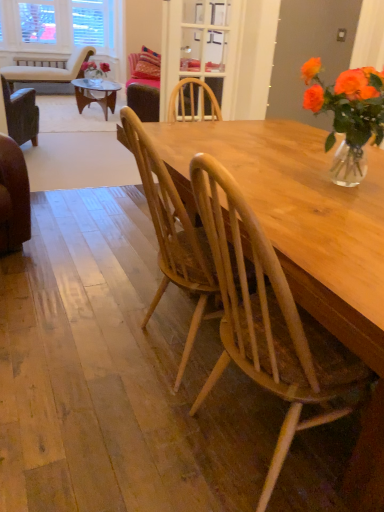
Question: Is clear glass door at upper center taller than beige fabric chair at upper left, the third chair ordered from the bottom?

Choices:
 (A) yes
 (B) no

Answer: (A)

Question: Would you say beige fabric chair at upper left, the first chair from the left, is part of clear glass door at upper center's contents?

Choices:
 (A) yes
 (B) no

Answer: (B)

Question: Does clear glass door at upper center have a lesser width compared to beige fabric chair at upper left, the 1th chair viewed from the back?

Choices:
 (A) yes
 (B) no

Answer: (A)

Question: Does clear glass door at upper center appear on the left side of beige fabric chair at upper left, the third chair ordered from the bottom?

Choices:
 (A) yes
 (B) no

Answer: (B)

Question: Does clear glass door at upper center turn towards beige fabric chair at upper left, which ranks as the third chair in right-to-left order?

Choices:
 (A) yes
 (B) no

Answer: (B)

Question: From the image's perspective, is clear glass door at upper center over beige fabric chair at upper left, which ranks as the first chair in top-to-bottom order?

Choices:
 (A) yes
 (B) no

Answer: (B)

Question: From the image's perspective, is natural wood chair at center, which appears as the 1th chair when viewed from the right, located above clear glass door at upper center?

Choices:
 (A) yes
 (B) no

Answer: (B)

Question: Is natural wood chair at center, which appears as the 1th chair when viewed from the right, in contact with clear glass door at upper center?

Choices:
 (A) yes
 (B) no

Answer: (B)

Question: From the image's perspective, is natural wood chair at center, which appears as the 3th chair when viewed from the back, beneath clear glass door at upper center?

Choices:
 (A) yes
 (B) no

Answer: (A)

Question: Is natural wood chair at center, placed as the 1th chair when sorted from front to back, shorter than clear glass door at upper center?

Choices:
 (A) yes
 (B) no

Answer: (B)

Question: Does natural wood chair at center, which appears as the 3th chair when viewed from the back, come in front of clear glass door at upper center?

Choices:
 (A) no
 (B) yes

Answer: (B)

Question: Is natural wood chair at center, which appears as the 1th chair when viewed from the right, positioned beyond the bounds of clear glass door at upper center?

Choices:
 (A) no
 (B) yes

Answer: (B)

Question: Is clear glass door at upper center to the right of translucent glass vase at upper right from the viewer's perspective?

Choices:
 (A) yes
 (B) no

Answer: (B)